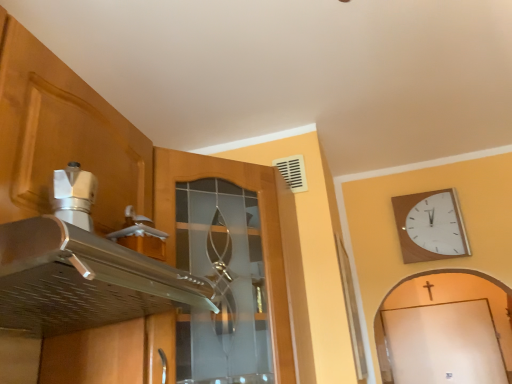
Question: Is point (29, 54) positioned closer to the camera than point (13, 251)?

Choices:
 (A) farther
 (B) closer

Answer: (A)

Question: Considering the positions of matte wood cabinet at upper left and silver metallic exhaust hood at upper left in the image, is matte wood cabinet at upper left bigger or smaller than silver metallic exhaust hood at upper left?

Choices:
 (A) small
 (B) big

Answer: (B)

Question: Which object is positioned closest to the matte wood cabinet at upper left?

Choices:
 (A) silver metallic exhaust hood at upper left
 (B) wooden wall clock at upper right

Answer: (A)

Question: Based on their relative distances, which object is nearer to the silver metallic exhaust hood at upper left?

Choices:
 (A) wooden wall clock at upper right
 (B) matte wood cabinet at upper left

Answer: (B)